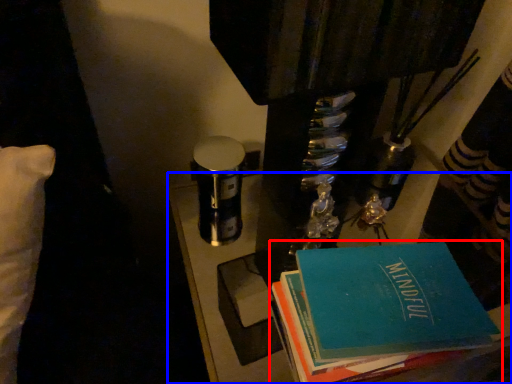
Question: Which point is further to the camera, book (highlighted by a red box) or table (highlighted by a blue box)?

Choices:
 (A) book
 (B) table

Answer: (B)